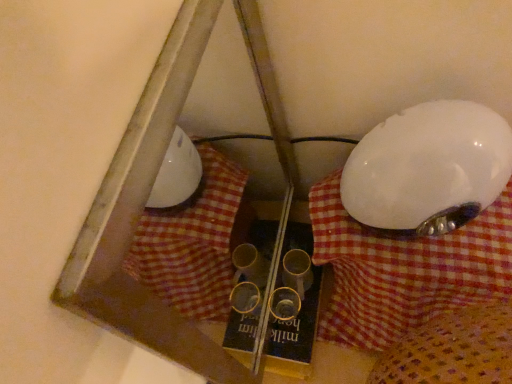
Question: Is white checkered fabric at center turned away from white glossy lampshade at right?

Choices:
 (A) yes
 (B) no

Answer: (B)

Question: Is white checkered fabric at center bigger than white glossy lampshade at right?

Choices:
 (A) no
 (B) yes

Answer: (B)

Question: Can white glossy lampshade at right be found inside white checkered fabric at center?

Choices:
 (A) no
 (B) yes

Answer: (A)

Question: From a real-world perspective, does white checkered fabric at center sit lower than white glossy lampshade at right?

Choices:
 (A) no
 (B) yes

Answer: (B)

Question: Is the position of white checkered fabric at center less distant than that of white glossy lampshade at right?

Choices:
 (A) no
 (B) yes

Answer: (A)

Question: Considering the positions of white glossy lampshade at right and white checkered fabric at center in the image, is white glossy lampshade at right bigger or smaller than white checkered fabric at center?

Choices:
 (A) big
 (B) small

Answer: (B)

Question: From the image's perspective, is white glossy lampshade at right above or below white checkered fabric at center?

Choices:
 (A) below
 (B) above

Answer: (B)

Question: From a real-world perspective, is white glossy lampshade at right positioned above or below white checkered fabric at center?

Choices:
 (A) below
 (B) above

Answer: (B)

Question: Does point (388, 124) appear closer or farther from the camera than point (339, 340)?

Choices:
 (A) closer
 (B) farther

Answer: (A)

Question: Visually, is white checkered fabric at center positioned to the left or to the right of yellow cardboard book at center?

Choices:
 (A) left
 (B) right

Answer: (B)

Question: From their relative heights in the image, would you say white checkered fabric at center is taller or shorter than yellow cardboard book at center?

Choices:
 (A) short
 (B) tall

Answer: (B)

Question: From a real-world perspective, relative to yellow cardboard book at center, is white checkered fabric at center vertically above or below?

Choices:
 (A) above
 (B) below

Answer: (A)

Question: From the image's perspective, relative to yellow cardboard book at center, is white checkered fabric at center above or below?

Choices:
 (A) above
 (B) below

Answer: (A)

Question: Considering the positions of white checkered fabric at center and white glossy lampshade at right in the image, is white checkered fabric at center wider or thinner than white glossy lampshade at right?

Choices:
 (A) wide
 (B) thin

Answer: (A)

Question: From a real-world perspective, is white checkered fabric at center physically located above or below white glossy lampshade at right?

Choices:
 (A) above
 (B) below

Answer: (B)